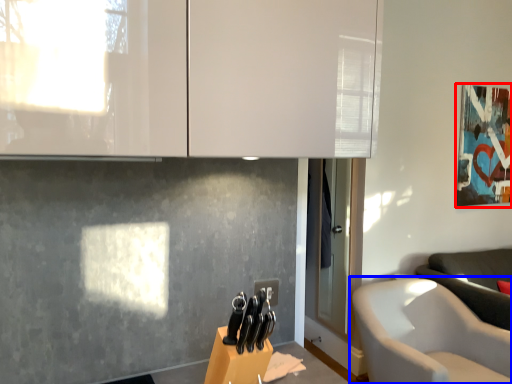
Question: Which object appears closest to the camera in this image, picture frame (highlighted by a red box) or chair (highlighted by a blue box)?

Choices:
 (A) picture frame
 (B) chair

Answer: (B)